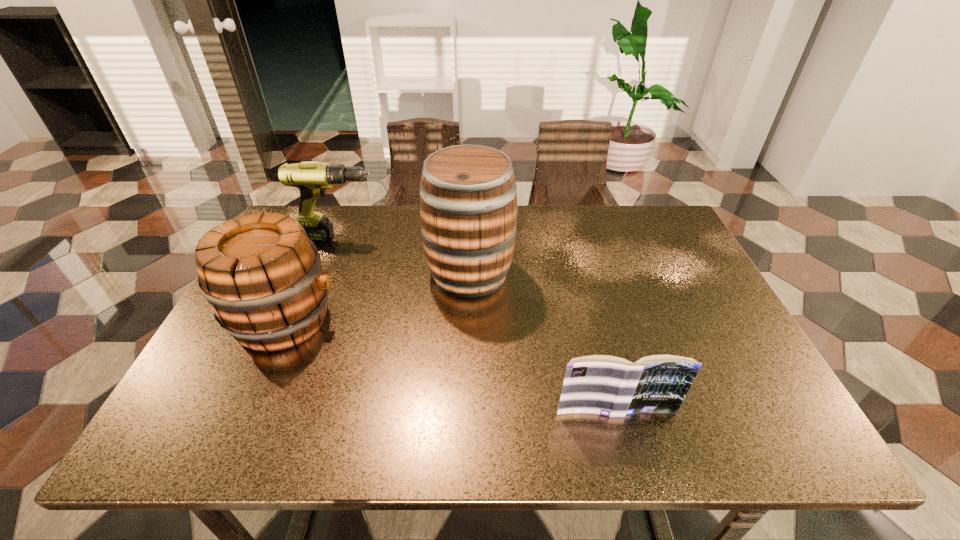
Where is `free spot that satisfies the following two spatial constraints: 1. on the back side of the taller cider; 2. on the handle side of the drill`? free spot that satisfies the following two spatial constraints: 1. on the back side of the taller cider; 2. on the handle side of the drill is located at coordinates (470, 238).

In order to click on free space that satisfies the following two spatial constraints: 1. on the handle side of the taller cider; 2. on the left side of the drill in this screenshot , I will do `click(325, 272)`.

The image size is (960, 540). Find the location of `vacant space that satisfies the following two spatial constraints: 1. on the back side of the taller cider; 2. on the handle side of the drill`. vacant space that satisfies the following two spatial constraints: 1. on the back side of the taller cider; 2. on the handle side of the drill is located at coordinates (470, 238).